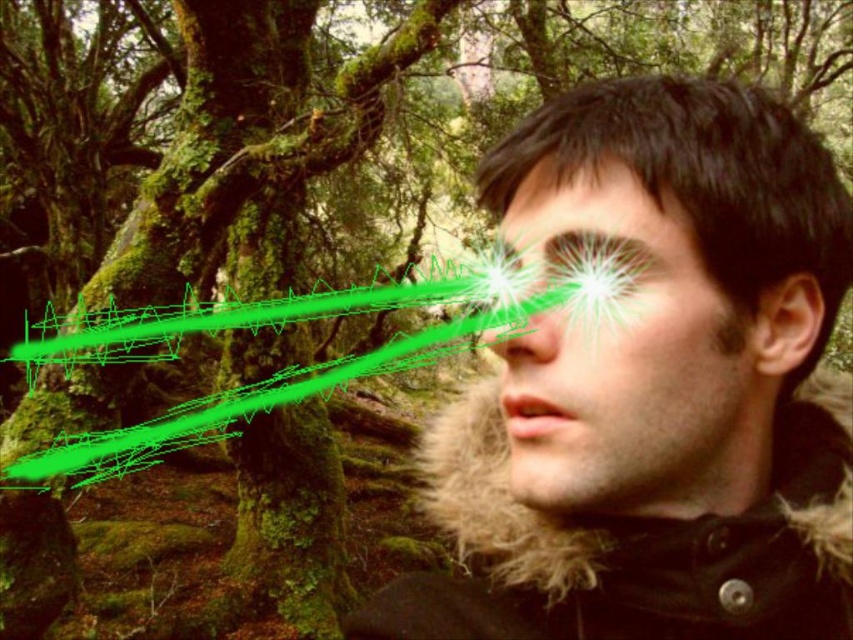
You are a photographer trying to capture a portrait of the person in the dark brown fur coat at center and the matte black face at center. Since you want to focus on the face, which part should you zoom in on and why?

You should zoom in on the matte black face at center because it is smaller in size compared to the dark brown fur coat at center, as stated in the description.

You are navigating through a forest and come across two points marked in the scene. You need to place a small marker at the point that is closer to you. Which point should you choose between point (431, 435) and point (509, 458)?

Point (509, 458) is closer to you since the description states that point (431, 435) is behind it.

You are a photographer trying to capture a closeup of the dark brown fur coat at center. Your camera has a minimum focusing distance of 14 inches. Will you be able to take the photo without moving closer?

The dark brown fur coat at center is 13.72 inches from the viewer. Since this distance is less than the camera minimum focusing distance of 14 inches, you cannot take the photo without moving back or adjusting your position to increase the distance.